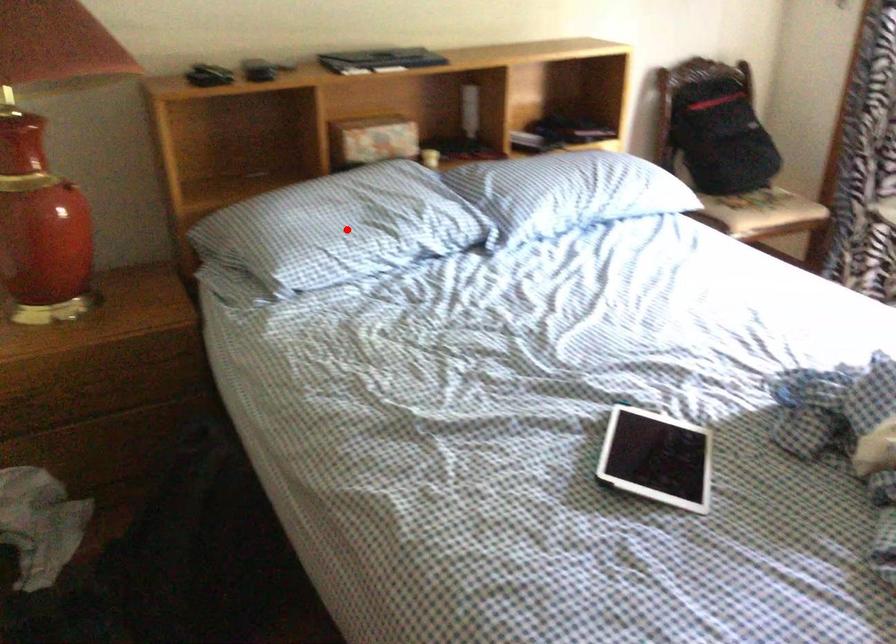
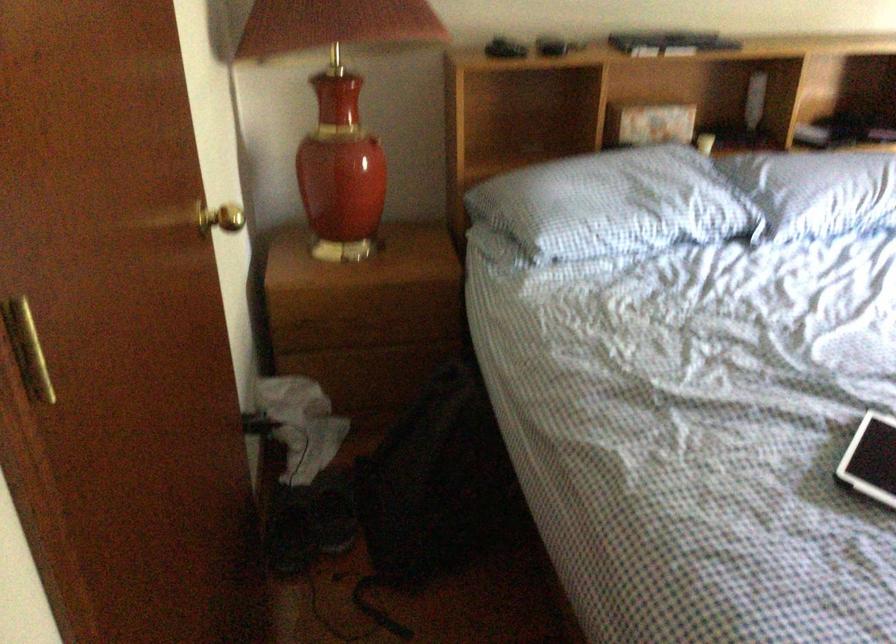
Find the pixel in the second image that matches the highlighted location in the first image.

(613, 204)